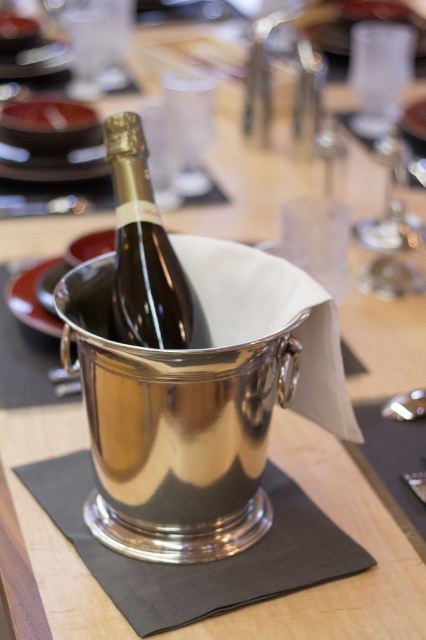
Who is lower down, shiny silver bottle at center or polished metal spoon at lower right?

polished metal spoon at lower right is below.

Where is `shiny silver bottle at center`? shiny silver bottle at center is located at coordinates (143, 248).

Locate an element on the screen. The width and height of the screenshot is (426, 640). shiny silver bottle at center is located at coordinates (143, 248).

In order to click on shiny silver bottle at center in this screenshot , I will do `click(143, 248)`.